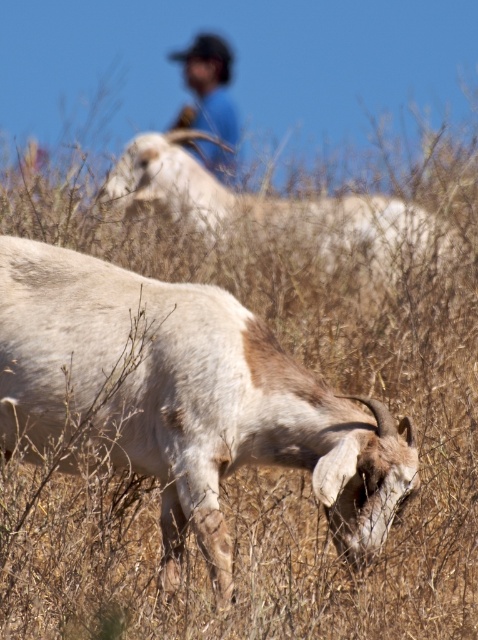
Question: Can you confirm if white woolen goat at lower center is thinner than white woolen goat at upper center?

Choices:
 (A) no
 (B) yes

Answer: (B)

Question: Is white woolen goat at lower center to the left of blue cotton shirt at upper center from the viewer's perspective?

Choices:
 (A) yes
 (B) no

Answer: (B)

Question: Which of the following is the farthest from the observer?

Choices:
 (A) (228, 465)
 (B) (235, 109)

Answer: (B)

Question: Estimate the real-world distances between objects in this image. Which object is closer to the white woolen goat at upper center?

Choices:
 (A) white woolen goat at lower center
 (B) blue cotton shirt at upper center

Answer: (B)

Question: Based on their relative distances, which object is nearer to the blue cotton shirt at upper center?

Choices:
 (A) white woolen goat at lower center
 (B) white woolen goat at upper center

Answer: (B)

Question: Does white woolen goat at lower center appear under blue cotton shirt at upper center?

Choices:
 (A) yes
 (B) no

Answer: (A)